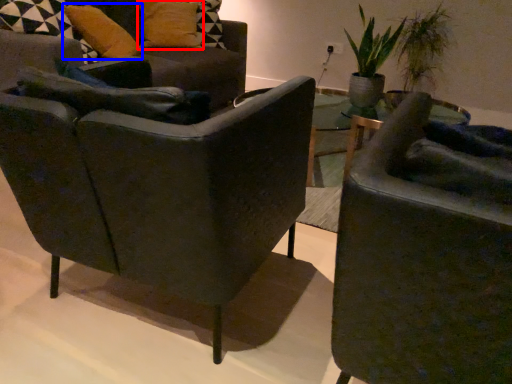
Question: Which object appears closest to the camera in this image, pillow (highlighted by a red box) or pillow (highlighted by a blue box)?

Choices:
 (A) pillow
 (B) pillow

Answer: (B)